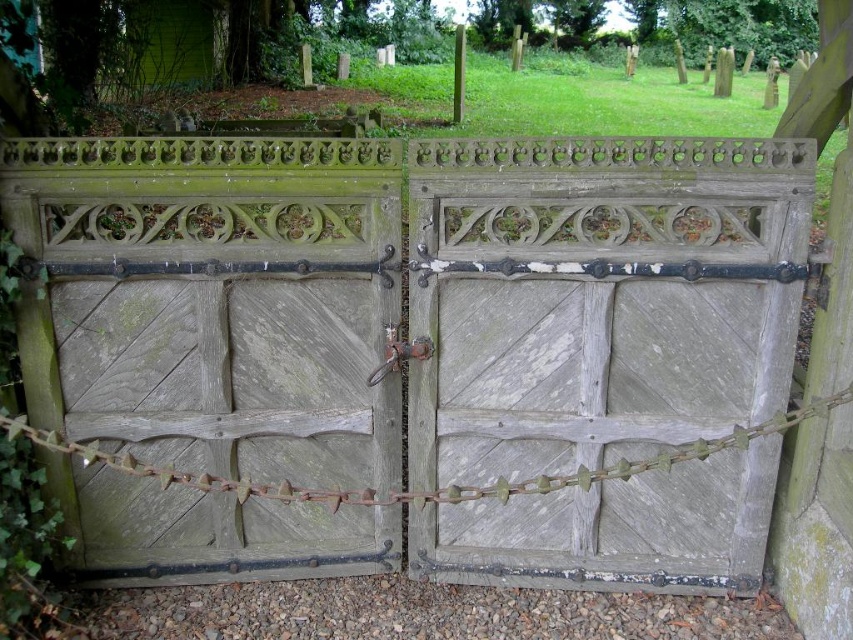
In the scene shown: Is green wood gate at center bigger than weathered wood gate at center?

Correct, green wood gate at center is larger in size than weathered wood gate at center.

Based on the photo, who is higher up, green wood gate at center or weathered wood gate at center?

weathered wood gate at center

Does point (186, 422) come farther from viewer compared to point (492, 232)?

Yes.

At what (x,y) coordinates should I click in order to perform the action: click on green wood gate at center. Please return your answer as a coordinate pair (x, y). The width and height of the screenshot is (853, 640). Looking at the image, I should click on (409, 298).